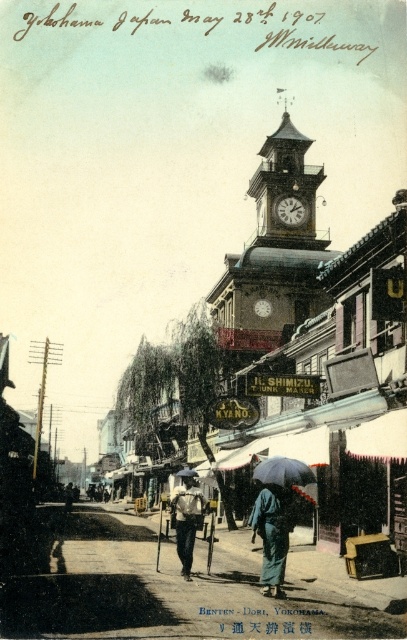
You are a tourist in Yokohama in 1907 and see the light brown fabric pants at center and the black matte umbrella at center in the street scene. Which object is positioned to the left of the other?

The light brown fabric pants at center are to the left of the black matte umbrella at center.

You are a tourist in the vintage Yokohama street scene from 1907. You notice a person wearing light brown fabric pants at center. Where exactly is this person located in the scene?

The light brown fabric pants at center are located at point 0.812 on the x axis and 0.459 on the y axis.

You are a pedestrian caught in the rain while walking down the street in the vintage Yokohama scene. You see two umbrellas available for rent at a nearby shop. The black matte umbrella at center and the transparent blue umbrella at center. Which umbrella is covering the other one?

The black matte umbrella at center is positioned over transparent blue umbrella at center, so the black matte umbrella is covering the transparent blue umbrella.